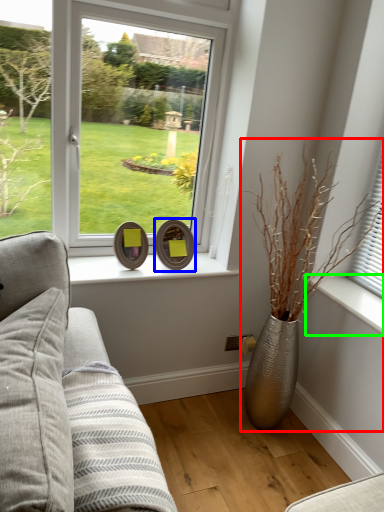
Question: Which object is the farthest from houseplant (highlighted by a red box)? Choose among these: picture frame (highlighted by a blue box) or window sill (highlighted by a green box).

Choices:
 (A) picture frame
 (B) window sill

Answer: (A)